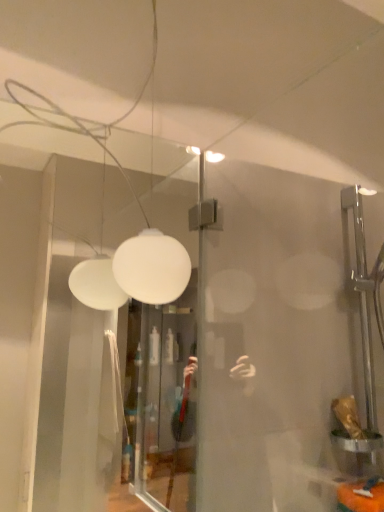
In order to click on white matte sphere at upper center in this screenshot , I will do `click(150, 262)`.

Image resolution: width=384 pixels, height=512 pixels. What do you see at coordinates (150, 262) in the screenshot? I see `white matte sphere at upper center` at bounding box center [150, 262].

Where is `white matte sphere at upper center`? white matte sphere at upper center is located at coordinates [150, 262].